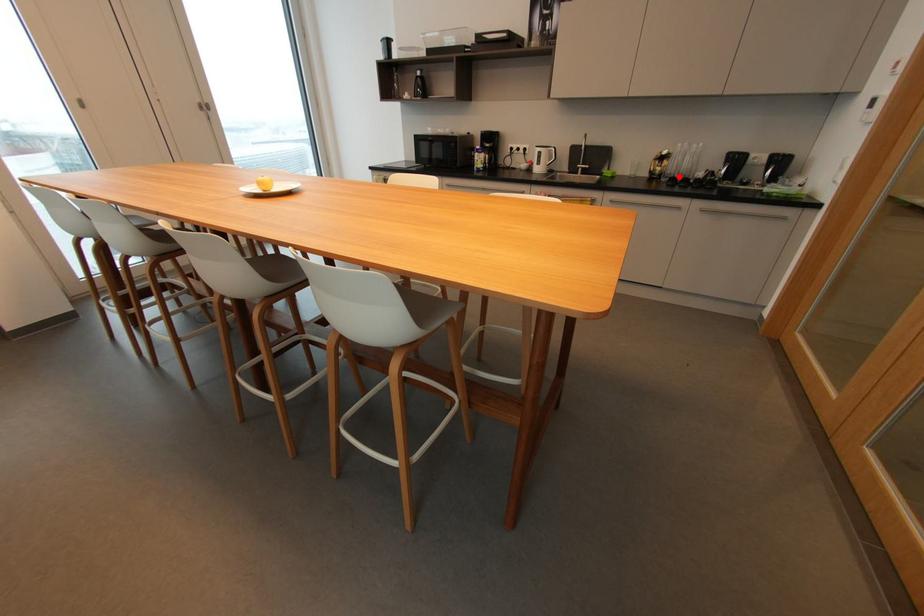
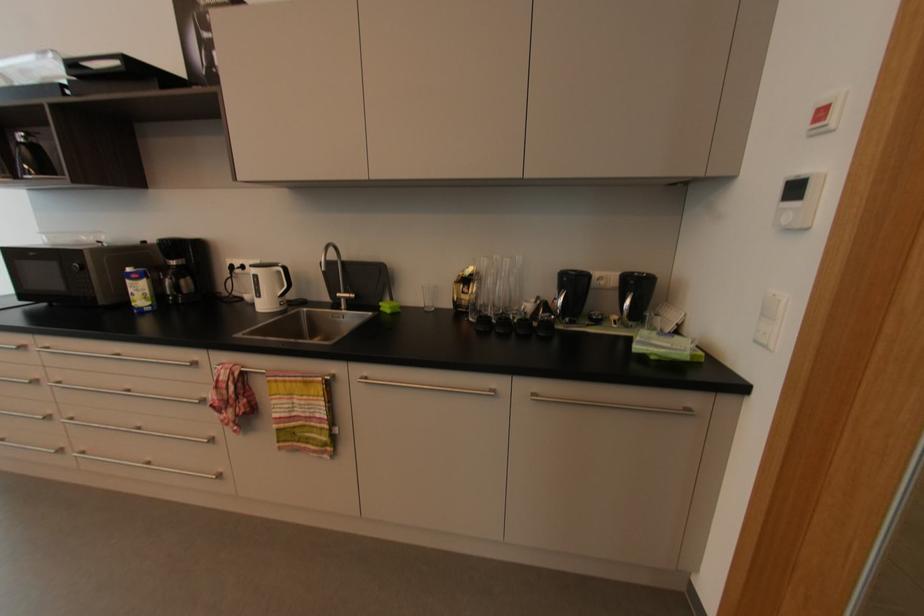
Locate, in the second image, the point that corresponds to the highlighted location in the first image.

(493, 313)